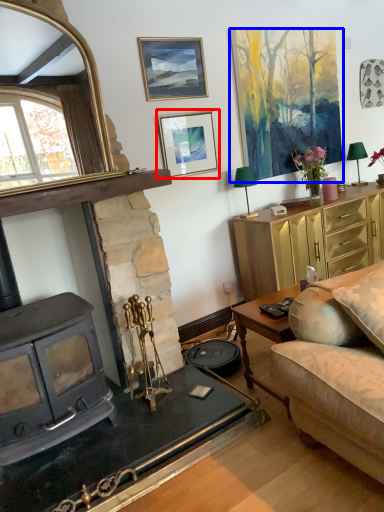
Question: Which object appears farthest to the camera in this image, picture frame (highlighted by a red box) or picture frame (highlighted by a blue box)?

Choices:
 (A) picture frame
 (B) picture frame

Answer: (B)